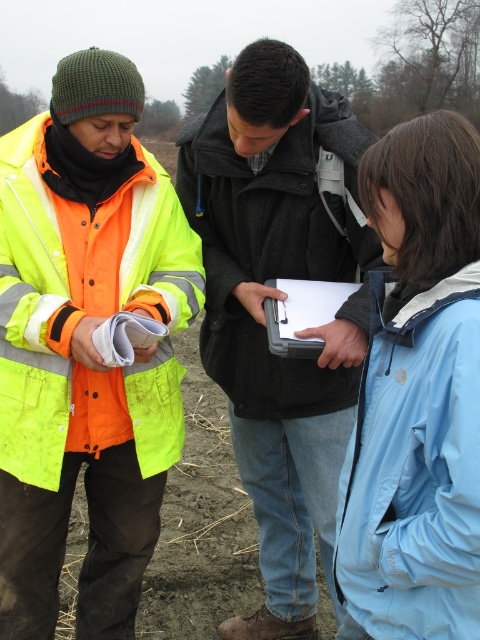
Can you confirm if neon yellow reflective jacket at left is smaller than dark gray wool jacket at center?

Correct, neon yellow reflective jacket at left occupies less space than dark gray wool jacket at center.

Is neon yellow reflective jacket at left to the left of dark gray wool jacket at center from the viewer's perspective?

Correct, you'll find neon yellow reflective jacket at left to the left of dark gray wool jacket at center.

Which is behind, point (38, 472) or point (331, 93)?

Positioned behind is point (331, 93).

You are a GUI agent. You are given a task and a screenshot of the screen. Output one action in this format:
    pyautogui.click(x=<x>, y=<y>)
    Task: Click on the neon yellow reflective jacket at left
    
    Given the screenshot: What is the action you would take?
    pyautogui.click(x=85, y=348)

Is neon yellow reflective jacket at left shorter than black plastic clipboard at center?

No.

Who is more distant from viewer, (x=38, y=380) or (x=316, y=321)?

Point (x=316, y=321)

Which is in front, point (26, 392) or point (325, 282)?

Positioned in front is point (26, 392).

Identify the location of neon yellow reflective jacket at left. The image size is (480, 640). (85, 348).

Does blue softshell jacket at center appear over black plastic clipboard at center?

Incorrect, blue softshell jacket at center is not positioned above black plastic clipboard at center.

Which is behind, point (408, 380) or point (312, 312)?

Positioned behind is point (312, 312).

Measure the distance between point [428,428] and camera.

Point [428,428] is 3.95 feet away from camera.

This screenshot has height=640, width=480. I want to click on blue softshell jacket at center, so click(x=418, y=394).